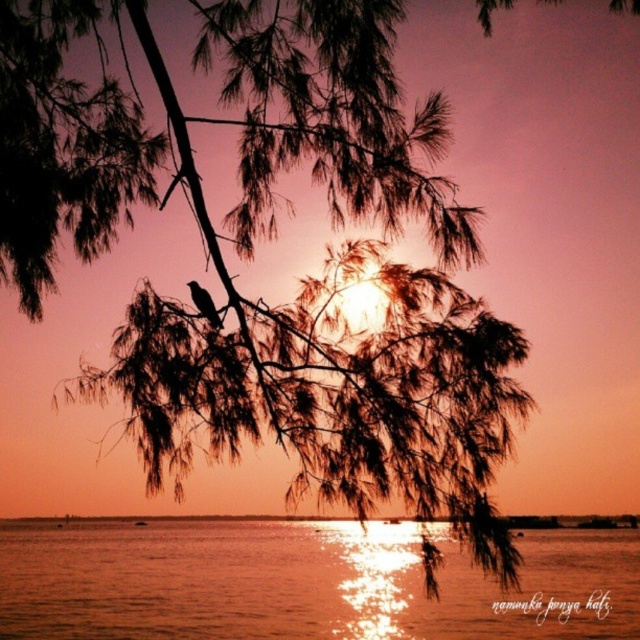
You are an ornithologist observing the scene. You need to determine if the brown feathered bird at upper left can see its reflection in the shiny reflective water at center. Based on their positions, can it?

The shiny reflective water at center is taller than brown feathered bird at upper left. Therefore, the brown feathered bird at upper left cannot see its reflection in the shiny reflective water at center because the water is positioned higher than the bird.

You are an ornithologist observing a brown feathered bird at upper left perched on a tree branch. You want to take a photo of it without disturbing it. Since the bird is sensitive to movement below, would positioning yourself near the shiny reflective water at center be a safe choice?

The shiny reflective water at center is below the brown feathered bird at upper left, so positioning yourself near the shiny reflective water at center would be safe as it is directly under the bird, minimizing disturbance from below.

You are an observer looking at the sunset scene. You notice the shiny reflective water at center and the brown feathered bird at upper left. Which object is positioned closer to you?

The shiny reflective water at center is closer to the viewer than the brown feathered bird at upper left.